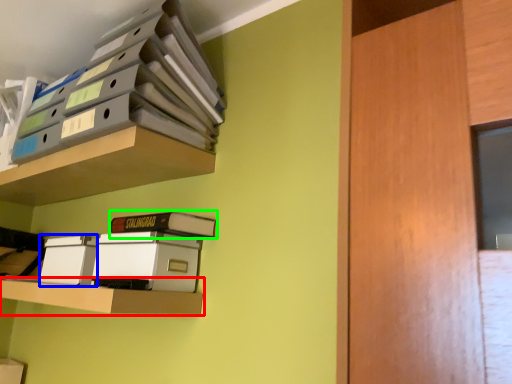
Question: Based on their relative distances, which object is farther from shelf (highlighted by a red box)? Choose from storage box (highlighted by a blue box) and paperback book (highlighted by a green box).

Choices:
 (A) storage box
 (B) paperback book

Answer: (B)